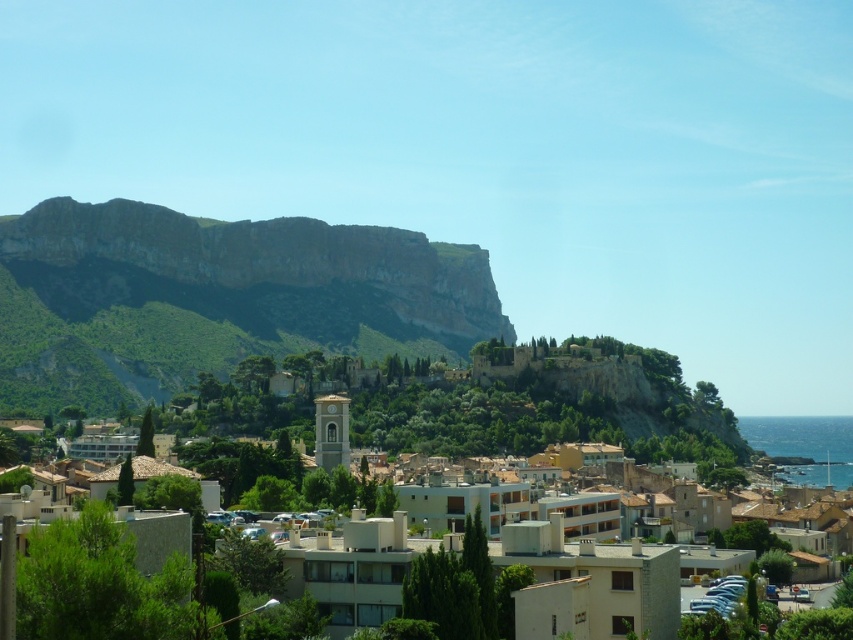
You are a tourist standing at the edge of the cliff overlooking the coastal town. You notice a point marked at coordinates (590, 582) in the image. According to the map, this point corresponds to a specific landmark in the town. Which landmark is this point indicating?

The point marked at coordinates (590, 582) indicates the beige stone town at center.

You are a tourist standing in the coastal town and want to take a photo of the smooth stone bell tower at center without the rugged stone cliff at left blocking it. How should you adjust your position?

Move to the right side of the scene so that the rugged stone cliff at left is no longer in front of the smooth stone bell tower at center.

Looking at this image, you are a tourist standing in the coastal town and want to take a photo that includes both the beige stone town at center and the smooth stone bell tower at center. Since you have a wide angle lens, you need to know which one is taller to frame the shot properly. Which object is taller?

The beige stone town at center is much taller than the smooth stone bell tower at center, so you should frame the shot with the beige stone town at center as the dominant element.